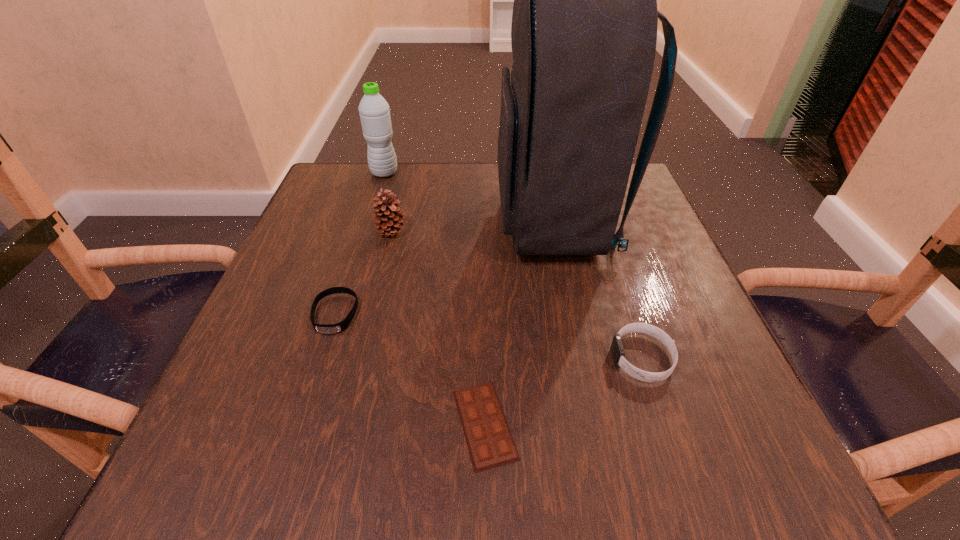
Where is `water bottle that is at the far edge`? The width and height of the screenshot is (960, 540). water bottle that is at the far edge is located at coordinates (374, 111).

You are a GUI agent. You are given a task and a screenshot of the screen. Output one action in this format:
    pyautogui.click(x=<x>, y=<y>)
    Task: Click on the object located at the near edge
    Image resolution: width=960 pixels, height=540 pixels.
    Given the screenshot: What is the action you would take?
    pyautogui.click(x=488, y=437)

Identify the location of water bottle located at the left edge. This screenshot has width=960, height=540. (374, 111).

The width and height of the screenshot is (960, 540). In order to click on wristband located in the left edge section of the desktop in this screenshot , I will do `click(339, 327)`.

Where is `backpack present at the right edge`? backpack present at the right edge is located at coordinates (584, 26).

Where is `wristband that is at the right edge`? This screenshot has width=960, height=540. wristband that is at the right edge is located at coordinates (617, 349).

Locate an element on the screen. The image size is (960, 540). object located at the far left corner is located at coordinates (374, 111).

The image size is (960, 540). In order to click on object that is positioned at the far right corner in this screenshot , I will do `click(584, 26)`.

Locate an element on the screen. This screenshot has width=960, height=540. free space at the far edge of the desktop is located at coordinates (408, 207).

This screenshot has width=960, height=540. I want to click on vacant space at the left edge of the desktop, so click(x=252, y=358).